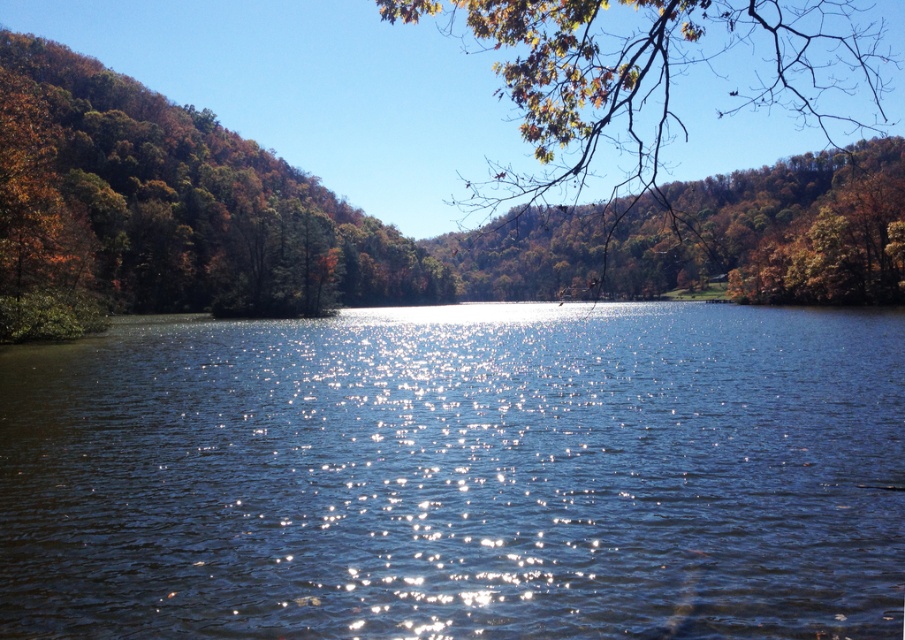
How far apart are blue liquid water at center and brown leafy branch at upper right?

They are 302.23 feet apart.

Between point (879, 444) and point (811, 54), which one is positioned in front?

Point (879, 444)

Who is more forward, (389, 483) or (525, 81)?

Positioned in front is point (525, 81).

Locate an element on the screen. The width and height of the screenshot is (905, 640). blue liquid water at center is located at coordinates (458, 474).